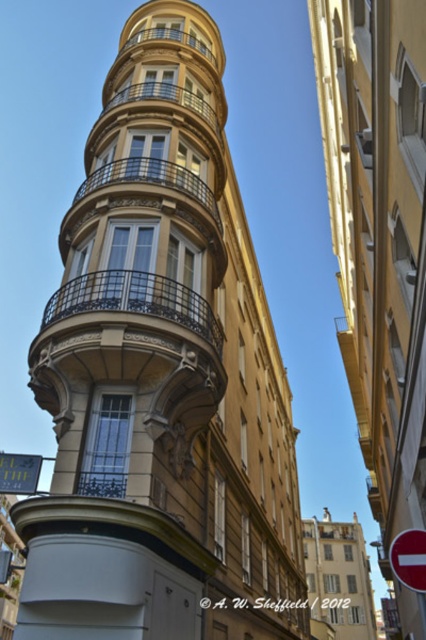
Question: Can you confirm if black wrought iron balcony at upper left is positioned to the left of red plastic traffic sign at upper right?

Choices:
 (A) no
 (B) yes

Answer: (B)

Question: Which of the following is the farthest from the observer?

Choices:
 (A) black wrought iron balcony at upper left
 (B) red plastic traffic sign at upper right

Answer: (A)

Question: Among these points, which one is farthest from the camera?

Choices:
 (A) click(x=77, y=289)
 (B) click(x=403, y=563)
 (C) click(x=16, y=452)
 (D) click(x=186, y=77)

Answer: (C)

Question: Considering the real-world distances, which object is farthest from the green reflective sign at center?

Choices:
 (A) golden stone tower at center
 (B) red plastic traffic sign at upper right

Answer: (A)

Question: Is golden stone tower at center further to camera compared to green reflective sign at center?

Choices:
 (A) yes
 (B) no

Answer: (B)

Question: Does golden stone tower at center have a lesser width compared to green reflective sign at center?

Choices:
 (A) yes
 (B) no

Answer: (B)